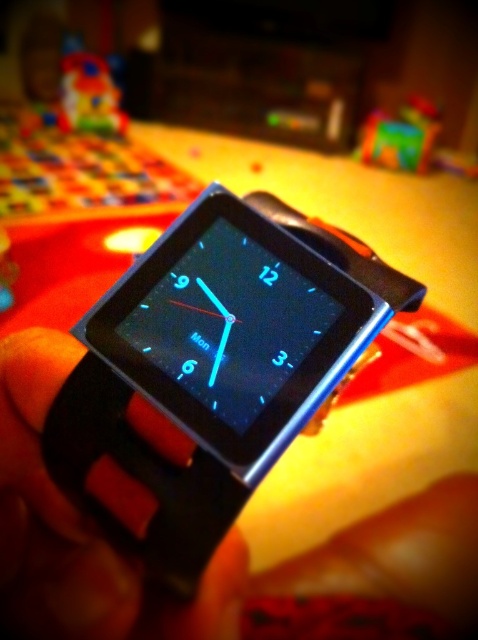
Question: Which object is farther from the camera taking this photo?

Choices:
 (A) rubberized plastic toy at upper right
 (B) plastic toy at upper left
 (C) black rubber watch at center

Answer: (B)

Question: Among these points, which one is nearest to the camera?

Choices:
 (A) (54, 348)
 (B) (60, 106)
 (C) (414, 120)
 (D) (142, 524)

Answer: (D)

Question: Which point is farther from the camera taking this photo?

Choices:
 (A) (108, 83)
 (B) (373, 161)
 (C) (192, 506)
 (D) (43, 589)

Answer: (A)

Question: Can you confirm if black matte watch at center is positioned above plastic toy at upper left?

Choices:
 (A) no
 (B) yes

Answer: (A)

Question: Is black rubber watch at center bigger than plastic toy at upper left?

Choices:
 (A) yes
 (B) no

Answer: (A)

Question: Is black matte watch at center to the right of rubberized plastic toy at upper right from the viewer's perspective?

Choices:
 (A) no
 (B) yes

Answer: (A)